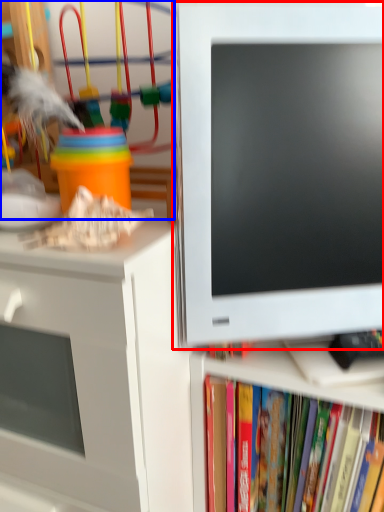
Question: Which of the following is the closest to the observer, computer monitor (highlighted by a red box) or toy (highlighted by a blue box)?

Choices:
 (A) computer monitor
 (B) toy

Answer: (A)